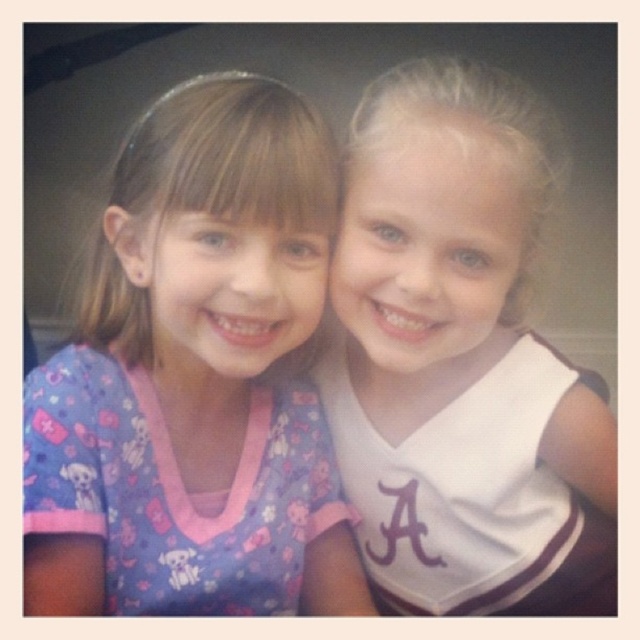
Can you confirm if purple fabric shirt at center is wider than white jersey at center?

No.

Is purple fabric shirt at center above white jersey at center?

Indeed, purple fabric shirt at center is positioned over white jersey at center.

Does point (26, 424) come in front of point (417, 326)?

That is False.

Locate an element on the screen. Image resolution: width=640 pixels, height=640 pixels. purple fabric shirt at center is located at coordinates (195, 378).